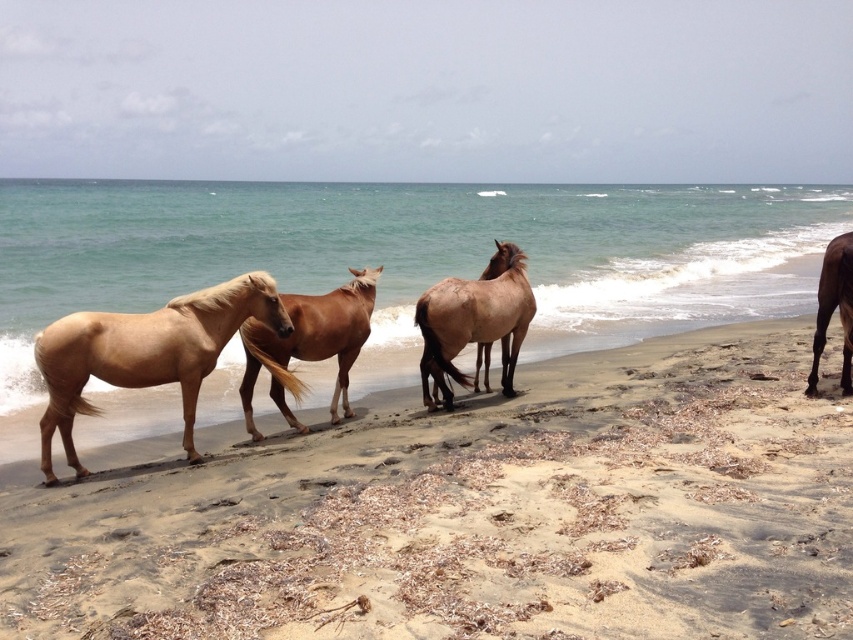
You are standing at the origin point of the coordinate system. You want to walk towards the light brown glossy horse at left. What coordinates should you move to reach it?

You should move to the coordinates point at 0.553 on the x axis and 0.171 on the y axis to reach the light brown glossy horse at left.

Based on the photo, you are standing on the beach and want to take a photo of the light brown glossy horse at left. Which direction should you face to ensure the horse is in the frame?

Since the light brown glossy horse at left is located at point 0.553 on the x axis and 0.171 on the y axis, you should face towards the left side of the beach to capture the horse in your photo.

You are standing at the center of the beach and see the point marked as point (474, 321). What is the nearest object to this point?

The nearest object to point (474, 321) is the brown matte horse at center, as it is represented by that point.